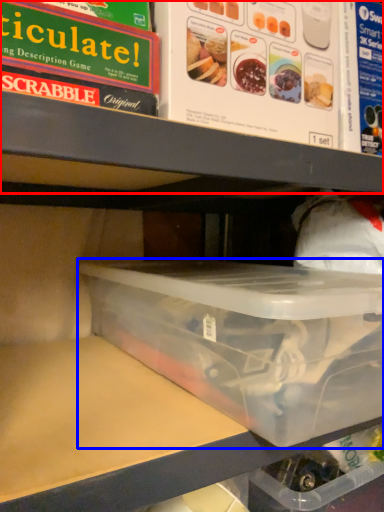
Question: Which of the following is the closest to the observer, shelf (highlighted by a red box) or box (highlighted by a blue box)?

Choices:
 (A) shelf
 (B) box

Answer: (B)